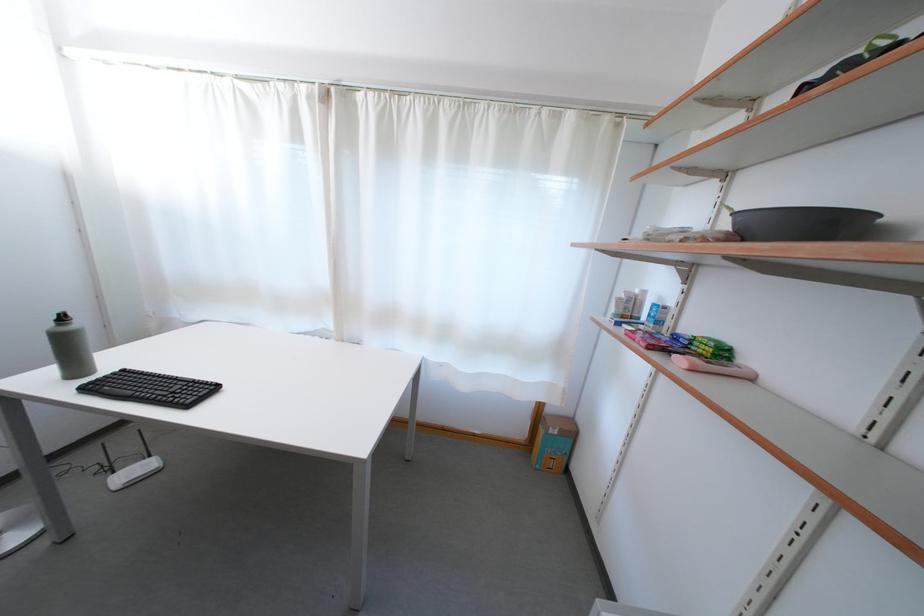
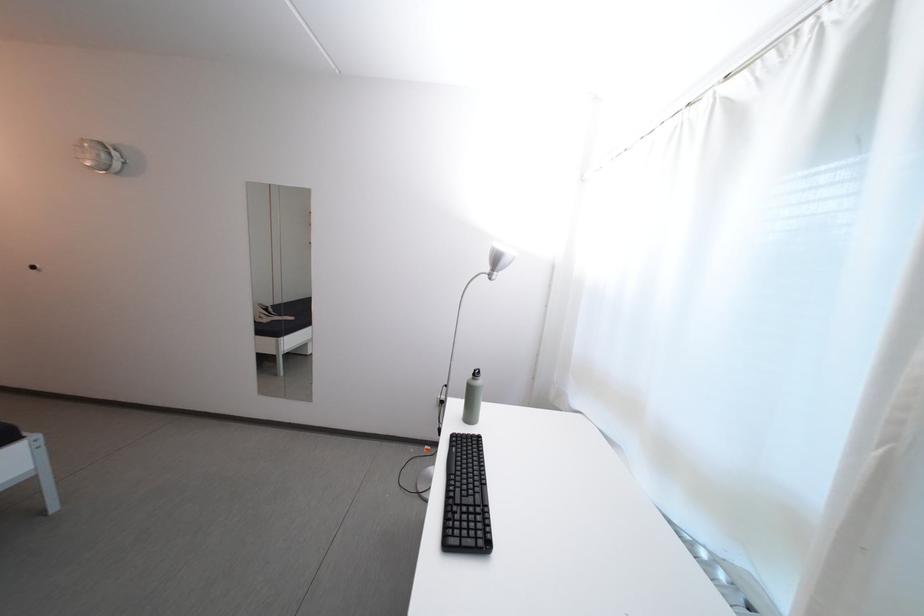
Question: How did the camera likely rotate?

Choices:
 (A) Left
 (B) Right
 (C) Up
 (D) Down

Answer: (A)